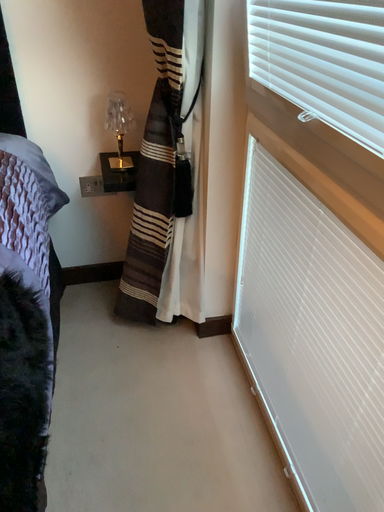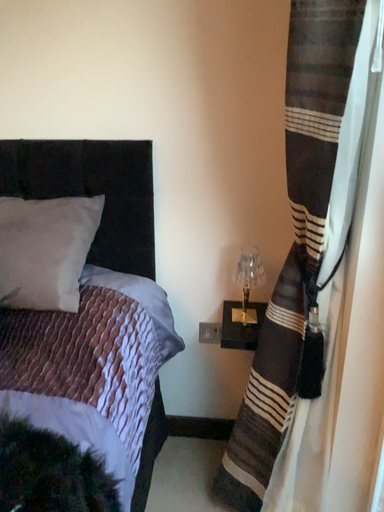
Question: How did the camera likely rotate when shooting the video?

Choices:
 (A) rotated downward
 (B) rotated upward

Answer: (B)